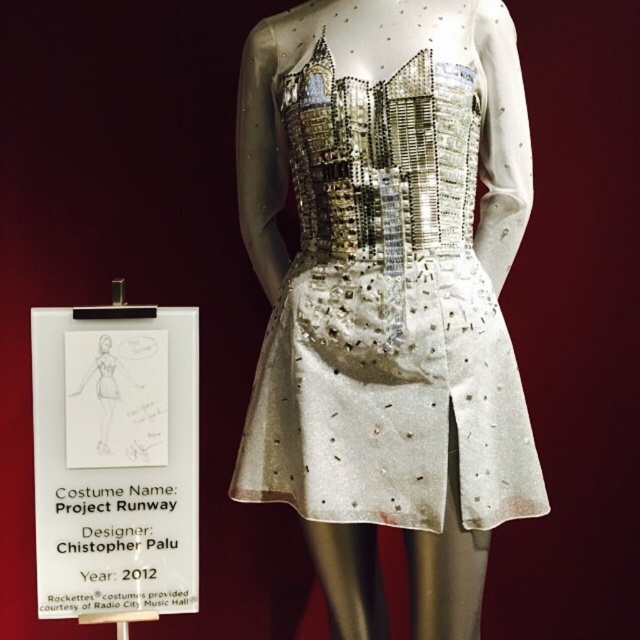
Question: Is satin-like silver dress at center bigger than white paper at center?

Choices:
 (A) yes
 (B) no

Answer: (A)

Question: Observing the image, what is the correct spatial positioning of satin-like silver dress at center in reference to white paper at center?

Choices:
 (A) below
 (B) above

Answer: (B)

Question: Which of the following is the closest to the observer?

Choices:
 (A) (541, 490)
 (B) (99, 460)

Answer: (B)

Question: Among these objects, which one is farthest from the camera?

Choices:
 (A) white paper at center
 (B) satin-like silver dress at center

Answer: (B)

Question: Can you confirm if satin-like silver dress at center is smaller than white paper at center?

Choices:
 (A) no
 (B) yes

Answer: (A)